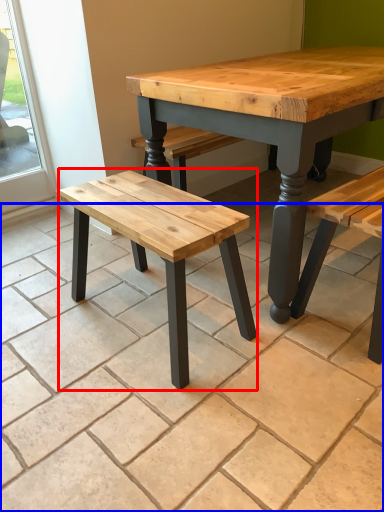
Question: Among these objects, which one is farthest to the camera, stool (highlighted by a red box) or tile (highlighted by a blue box)?

Choices:
 (A) stool
 (B) tile

Answer: (A)